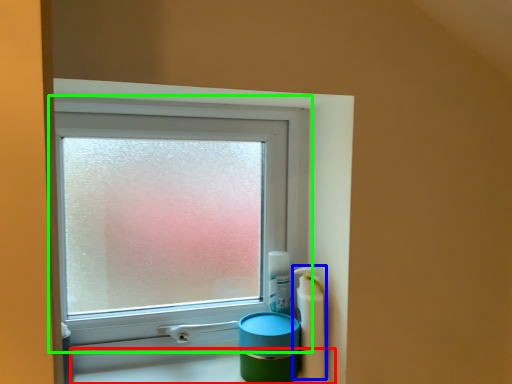
Question: Based on their relative distances, which object is nearer to counter top (highlighted by a red box)? Choose from mouthwash (highlighted by a blue box) and window (highlighted by a green box).

Choices:
 (A) mouthwash
 (B) window

Answer: (A)